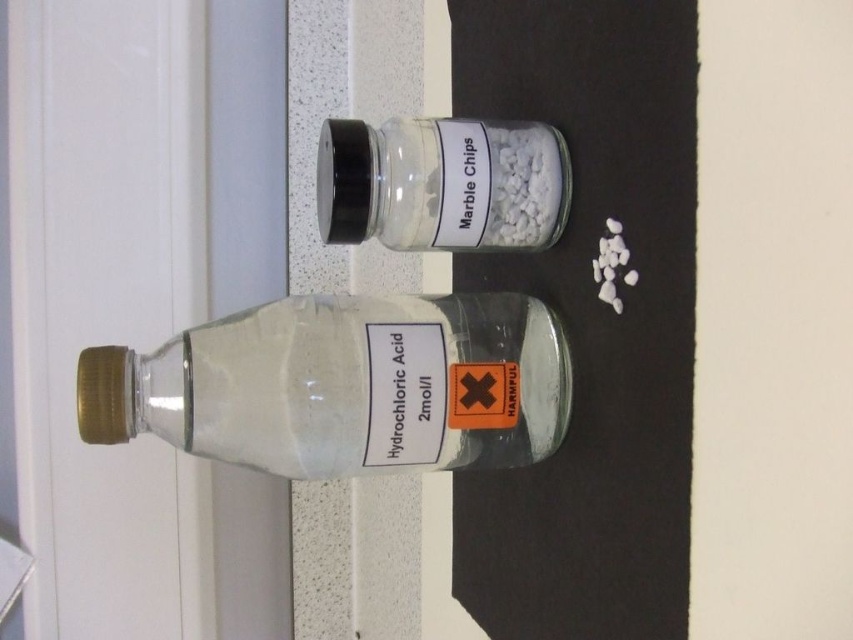
From the picture: Is transparent glass bottle at center to the left of transparent glass jar of marble chips at center from the viewer's perspective?

Correct, you'll find transparent glass bottle at center to the left of transparent glass jar of marble chips at center.

Is point (173, 378) behind point (511, 234)?

No, it is in front of (511, 234).

Image resolution: width=853 pixels, height=640 pixels. Find the location of `transparent glass bottle at center`. transparent glass bottle at center is located at coordinates (344, 385).

Who is positioned more to the right, transparent glass door at left or transparent glass bottle at center?

transparent glass bottle at center is more to the right.

Can you confirm if transparent glass door at left is thinner than transparent glass bottle at center?

Correct, transparent glass door at left's width is less than transparent glass bottle at center's.

The width and height of the screenshot is (853, 640). What do you see at coordinates (141, 301) in the screenshot? I see `transparent glass door at left` at bounding box center [141, 301].

Find the location of a particular element. This screenshot has width=853, height=640. transparent glass door at left is located at coordinates (141, 301).

Can you confirm if transparent glass door at left is smaller than transparent glass jar of marble chips at center?

Actually, transparent glass door at left might be larger than transparent glass jar of marble chips at center.

Which is above, transparent glass door at left or transparent glass jar of marble chips at center?

Positioned higher is transparent glass jar of marble chips at center.

Image resolution: width=853 pixels, height=640 pixels. I want to click on transparent glass door at left, so click(x=141, y=301).